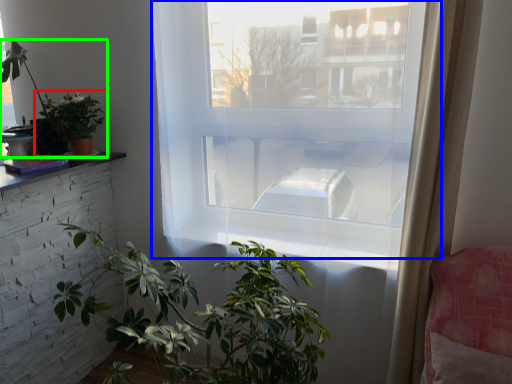
Question: Which object is the farthest from houseplant (highlighted by a red box)? Choose among these: window (highlighted by a blue box) or houseplant (highlighted by a green box).

Choices:
 (A) window
 (B) houseplant

Answer: (A)